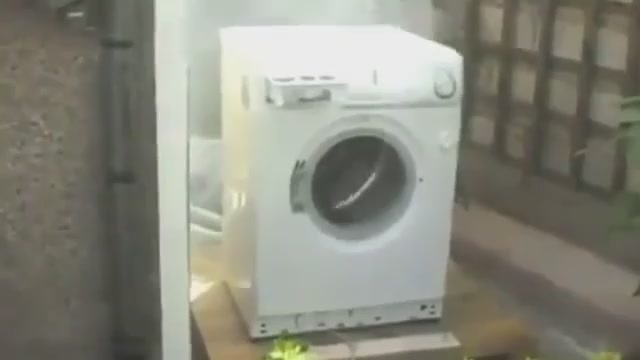
Find the location of a particular element. This screenshot has height=360, width=640. soap dispenser is located at coordinates (273, 96).